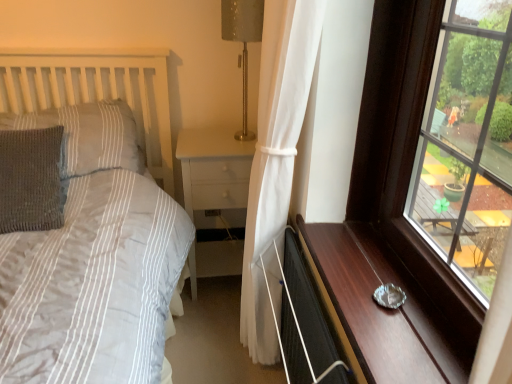
Measure the distance between point (238, 12) and camera.

Point (238, 12) and camera are 1.63 meters apart.

This screenshot has height=384, width=512. What are the coordinates of `metallic gray table lamp at upper center` in the screenshot? It's located at (243, 42).

The height and width of the screenshot is (384, 512). What do you see at coordinates (305, 325) in the screenshot? I see `black matte screen door at lower right` at bounding box center [305, 325].

Where is `metallic silver ashtray at right`? The height and width of the screenshot is (384, 512). metallic silver ashtray at right is located at coordinates (383, 308).

What are the coordinates of `knitted gray pillow at left, which is the second pillow from bottom to top` in the screenshot? It's located at (88, 136).

Can you confirm if metallic silver ashtray at right is taller than knitted gray pillow at left, positioned as the 1th pillow in top-to-bottom order?

No.

Relative to knitted gray pillow at left, positioned as the 1th pillow in top-to-bottom order, is metallic silver ashtray at right in front or behind?

metallic silver ashtray at right is positioned closer to the viewer than knitted gray pillow at left, positioned as the 1th pillow in top-to-bottom order.

From the image's perspective, between metallic silver ashtray at right and knitted gray pillow at left, positioned as the 1th pillow in top-to-bottom order, who is located below?

metallic silver ashtray at right, from the image's perspective.

Would you say white glossy nightstand at center is outside black matte screen door at lower right?

That's correct, white glossy nightstand at center is outside of black matte screen door at lower right.

Which object is further away from the camera taking this photo, white glossy nightstand at center or black matte screen door at lower right?

Positioned behind is white glossy nightstand at center.

Can you confirm if white glossy nightstand at center is taller than black matte screen door at lower right?

Indeed, white glossy nightstand at center has a greater height compared to black matte screen door at lower right.

Is point (243, 160) in front of point (283, 333)?

No, it is not.

Can you confirm if white sheer curtain at center is shorter than knitted gray pillow at left, which is the second pillow from bottom to top?

In fact, white sheer curtain at center may be taller than knitted gray pillow at left, which is the second pillow from bottom to top.

Between white sheer curtain at center and knitted gray pillow at left, positioned as the 1th pillow in top-to-bottom order, which one has smaller width?

With smaller width is white sheer curtain at center.

From the image's perspective, is white sheer curtain at center on top of knitted gray pillow at left, positioned as the 1th pillow in top-to-bottom order?

No, from the image's perspective, white sheer curtain at center is not on top of knitted gray pillow at left, positioned as the 1th pillow in top-to-bottom order.

From a real-world perspective, is gray knitted pillow at left, which is counted as the 1th pillow, starting from the bottom, positioned above or below white glossy nightstand at center?

gray knitted pillow at left, which is counted as the 1th pillow, starting from the bottom, is situated higher than white glossy nightstand at center in the real world.

Between gray knitted pillow at left, which is counted as the 1th pillow, starting from the bottom, and white glossy nightstand at center, which one is positioned in front?

gray knitted pillow at left, which is counted as the 1th pillow, starting from the bottom, is closer to the camera.

From the picture: Considering the relative sizes of gray knitted pillow at left, the 2th pillow from the top, and white glossy nightstand at center in the image provided, is gray knitted pillow at left, the 2th pillow from the top, taller than white glossy nightstand at center?

Incorrect, the height of gray knitted pillow at left, the 2th pillow from the top, is not larger of that of white glossy nightstand at center.

Between gray knitted pillow at left, the 2th pillow from the top, and white glossy nightstand at center, which one has larger width?

Wider between the two is white glossy nightstand at center.

Would you say gray knitted pillow at left, the 2th pillow from the top, is inside or outside transparent glass window at right?

The correct answer is: outside.

Which object is further away from the camera taking this photo, gray knitted pillow at left, which is counted as the 1th pillow, starting from the bottom, or transparent glass window at right?

Positioned behind is gray knitted pillow at left, which is counted as the 1th pillow, starting from the bottom.

From the image's perspective, is gray knitted pillow at left, the 2th pillow from the top, above or below transparent glass window at right?

Clearly, from the image's perspective, gray knitted pillow at left, the 2th pillow from the top, is above transparent glass window at right.

Could you measure the distance between gray knitted pillow at left, the 2th pillow from the top, and transparent glass window at right?

The distance of gray knitted pillow at left, the 2th pillow from the top, from transparent glass window at right is 4.46 feet.

Between black matte screen door at lower right and metallic gray table lamp at upper center, which one appears on the right side from the viewer's perspective?

From the viewer's perspective, black matte screen door at lower right appears more on the right side.

Is black matte screen door at lower right located outside metallic gray table lamp at upper center?

That's correct, black matte screen door at lower right is outside of metallic gray table lamp at upper center.

Consider the image. Is the surface of black matte screen door at lower right in direct contact with metallic gray table lamp at upper center?

No, black matte screen door at lower right is not beside metallic gray table lamp at upper center.

Is black matte screen door at lower right oriented towards metallic gray table lamp at upper center?

No, black matte screen door at lower right is not turned towards metallic gray table lamp at upper center.

Considering the sizes of transparent glass window at right and metallic gray table lamp at upper center in the image, is transparent glass window at right taller or shorter than metallic gray table lamp at upper center?

transparent glass window at right is taller than metallic gray table lamp at upper center.

From a real-world perspective, which object stands above the other?

metallic gray table lamp at upper center.

From the image's perspective, would you say transparent glass window at right is positioned over metallic gray table lamp at upper center?

No, from the image's perspective, transparent glass window at right is not over metallic gray table lamp at upper center.

At what (x,y) coordinates should I click in order to perform the action: click on the 2nd pillow behind the metallic silver ashtray at right, starting your count from the anchor. Please return your answer as a coordinate pair (x, y). Looking at the image, I should click on (88, 136).

Where is `screen door below the white glossy nightstand at center (from the image's perspective)`? screen door below the white glossy nightstand at center (from the image's perspective) is located at coordinates (305, 325).

When comparing their distances from metallic silver ashtray at right, does knitted gray pillow at left, positioned as the 1th pillow in top-to-bottom order, or metallic gray table lamp at upper center seem closer?

Based on the image, metallic gray table lamp at upper center appears to be nearer to metallic silver ashtray at right.

Estimate the real-world distances between objects in this image. Which object is further from knitted gray pillow at left, positioned as the 1th pillow in top-to-bottom order, gray knitted pillow at left, which is counted as the 1th pillow, starting from the bottom, or white sheer curtain at center?

Among the two, white sheer curtain at center is located further to knitted gray pillow at left, positioned as the 1th pillow in top-to-bottom order.

Looking at the image, which one is located closer to metallic gray table lamp at upper center, white sheer curtain at center or white glossy nightstand at center?

white glossy nightstand at center lies closer to metallic gray table lamp at upper center than the other object.

Which object lies further to the anchor point black matte screen door at lower right, metallic gray table lamp at upper center or white glossy nightstand at center?

Among the two, metallic gray table lamp at upper center is located further to black matte screen door at lower right.

When comparing their distances from white glossy nightstand at center, does white sheer curtain at center or metallic silver ashtray at right seem further?

Based on the image, metallic silver ashtray at right appears to be further to white glossy nightstand at center.

When comparing their distances from black matte screen door at lower right, does white sheer curtain at center or gray knitted pillow at left, which is counted as the 1th pillow, starting from the bottom, seem further?

The object further to black matte screen door at lower right is gray knitted pillow at left, which is counted as the 1th pillow, starting from the bottom.

Estimate the real-world distances between objects in this image. Which object is closer to white glossy nightstand at center, transparent glass window at right or black matte screen door at lower right?

Among the two, black matte screen door at lower right is located nearer to white glossy nightstand at center.

When comparing their distances from metallic silver ashtray at right, does transparent glass window at right or white sheer curtain at center seem closer?

The object closer to metallic silver ashtray at right is transparent glass window at right.

The width and height of the screenshot is (512, 384). In order to click on pillow located between gray knitted pillow at left, the 2th pillow from the top, and metallic silver ashtray at right in the left-right direction in this screenshot , I will do `click(88, 136)`.

Locate an element on the screen. nightstand between knitted gray pillow at left, positioned as the 1th pillow in top-to-bottom order, and black matte screen door at lower right is located at coordinates (214, 169).

You are a GUI agent. You are given a task and a screenshot of the screen. Output one action in this format:
    pyautogui.click(x=<x>, y=<y>)
    Task: Click on the table lamp between metallic silver ashtray at right and white glossy nightstand at center along the z-axis
    This screenshot has height=384, width=512.
    Given the screenshot: What is the action you would take?
    click(x=243, y=42)

Where is `curtain between knitted gray pillow at left, positioned as the 1th pillow in top-to-bottom order, and transparent glass window at right from left to right`? Image resolution: width=512 pixels, height=384 pixels. curtain between knitted gray pillow at left, positioned as the 1th pillow in top-to-bottom order, and transparent glass window at right from left to right is located at coordinates (275, 154).